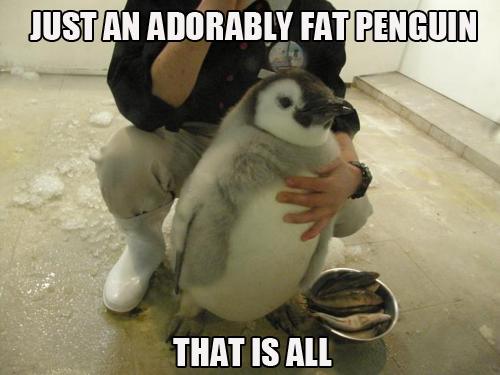
Where is `concrete floor`? This screenshot has height=375, width=500. concrete floor is located at coordinates (398, 247).